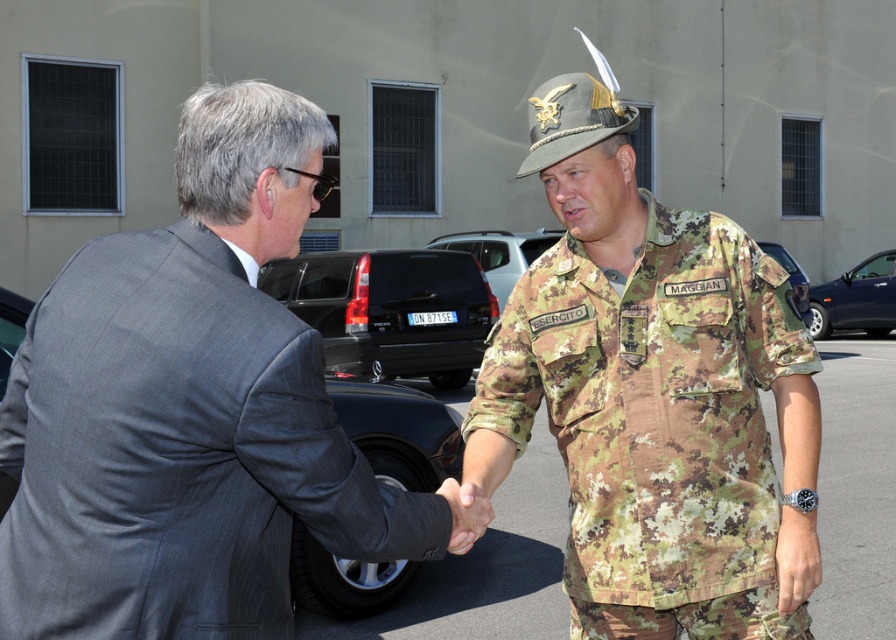
Question: Which point is closer to the camera?

Choices:
 (A) [257, 509]
 (B) [687, 440]

Answer: (A)

Question: Which of the following is the closest to the observer?

Choices:
 (A) gray pinstripe suit at center
 (B) camouflage fabric uniform at center

Answer: (A)

Question: Observing the image, what is the correct spatial positioning of gray pinstripe suit at center in reference to camouflage fabric uniform at center?

Choices:
 (A) below
 (B) above

Answer: (B)

Question: Can you confirm if gray pinstripe suit at center is bigger than camouflage fabric uniform at center?

Choices:
 (A) no
 (B) yes

Answer: (B)

Question: Is gray pinstripe suit at center to the right of camouflage fabric uniform at center from the viewer's perspective?

Choices:
 (A) no
 (B) yes

Answer: (A)